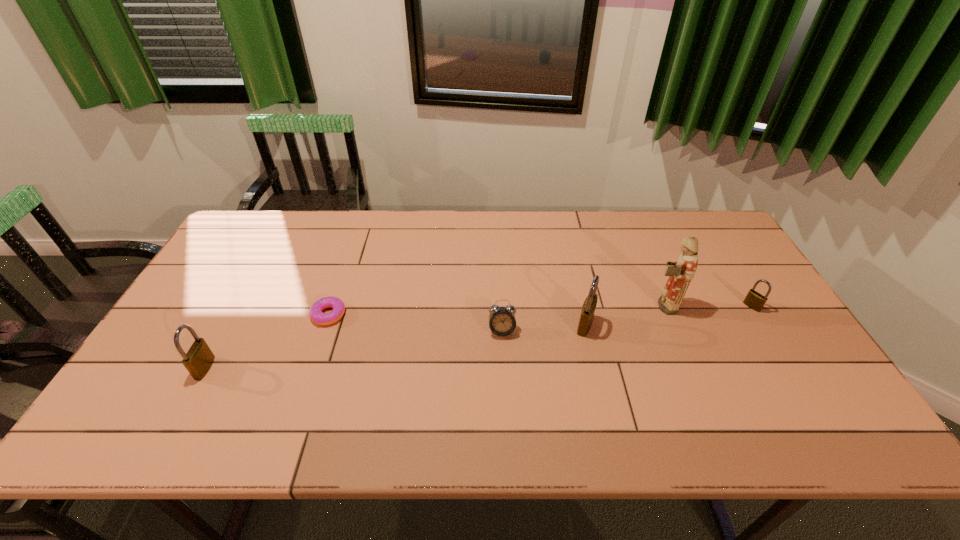
At what (x,y) coordinates should I click in order to perform the action: click on the third tallest object. Please return your answer as a coordinate pair (x, y). This screenshot has height=540, width=960. Looking at the image, I should click on (198, 360).

This screenshot has width=960, height=540. I want to click on the nearest object, so click(198, 360).

I want to click on the third object from right to left, so click(588, 309).

The image size is (960, 540). Find the location of `the second padlock from left to right`. the second padlock from left to right is located at coordinates click(x=588, y=309).

This screenshot has width=960, height=540. What are the coordinates of `the rightmost object` in the screenshot? It's located at (754, 300).

The image size is (960, 540). In order to click on the farthest padlock in this screenshot , I will do `click(754, 300)`.

Image resolution: width=960 pixels, height=540 pixels. Identify the location of doughnut. (316, 315).

Where is `the fifth object from right to left`? the fifth object from right to left is located at coordinates (316, 315).

Identify the location of the third object from left to right. (502, 322).

At what (x,y) coordinates should I click in order to perform the action: click on the second object from right to left. Please return your answer as a coordinate pair (x, y). This screenshot has width=960, height=540. Looking at the image, I should click on (681, 272).